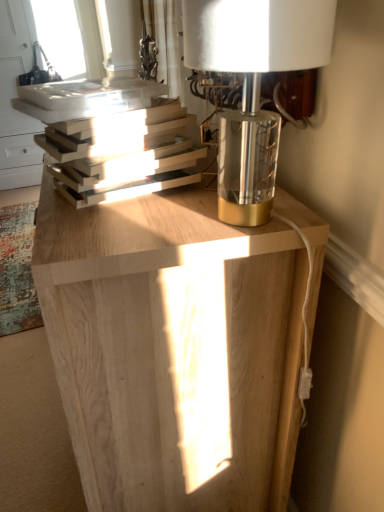
Measure the distance between metallic gold base at upper right and camera.

metallic gold base at upper right and camera are 16.26 inches apart.

This screenshot has height=512, width=384. Identify the location of natural wood table at center. (173, 349).

Describe the element at coordinates (15, 96) in the screenshot. This screenshot has height=512, width=384. I see `clear glass window at upper left` at that location.

At what (x,y) coordinates should I click in order to perform the action: click on hardcover books at left. Please return your answer as a coordinate pair (x, y). This screenshot has height=512, width=384. Looking at the image, I should click on (124, 156).

From the image's perspective, is clear glass window at upper left below metallic gold base at upper right?

No, from the image's perspective, clear glass window at upper left is not beneath metallic gold base at upper right.

Considering the relative sizes of clear glass window at upper left and metallic gold base at upper right in the image provided, is clear glass window at upper left taller than metallic gold base at upper right?

Correct, clear glass window at upper left is much taller as metallic gold base at upper right.

Is clear glass window at upper left wider than metallic gold base at upper right?

Yes.

What's the angular difference between clear glass window at upper left and metallic gold base at upper right's facing directions?

There is a 91.6-degree angle between the facing directions of clear glass window at upper left and metallic gold base at upper right.

Which point is more forward, (96, 22) or (190, 215)?

The point (190, 215) is closer.

Is there a large distance between clear glass window at upper left and natural wood table at center?

That's right, there is a large distance between clear glass window at upper left and natural wood table at center.

Do you think clear glass window at upper left is within natural wood table at center, or outside of it?

clear glass window at upper left is located beyond the bounds of natural wood table at center.

Would you say natural wood table at center is a long distance from clear glass window at upper left?

natural wood table at center is positioned a significant distance from clear glass window at upper left.

Is natural wood table at center oriented away from clear glass window at upper left?

No, clear glass window at upper left is not at the back of natural wood table at center.

Considering the positions of points (94, 350) and (32, 143), is point (94, 350) closer to camera compared to point (32, 143)?

Yes, it is in front of point (32, 143).

From a real-world perspective, which object stands above the other?

clear glass window at upper left is physically above.

Is metallic gold base at upper right completely or partially inside natural wood table at center?

No, metallic gold base at upper right is not inside natural wood table at center.

Which point is more distant from viewer, (298, 293) or (331, 35)?

The point (298, 293) is more distant.

Which is more to the left, natural wood table at center or metallic gold base at upper right?

natural wood table at center.

Considering the sizes of metallic gold base at upper right and natural wood table at center in the image, is metallic gold base at upper right bigger or smaller than natural wood table at center?

In the image, metallic gold base at upper right appears to be smaller than natural wood table at center.

Where is `lamp on the right side of natural wood table at center`? This screenshot has width=384, height=512. lamp on the right side of natural wood table at center is located at coordinates (253, 85).

Does metallic gold base at upper right appear on the right side of natural wood table at center?

Indeed, metallic gold base at upper right is positioned on the right side of natural wood table at center.

Looking at their sizes, would you say metallic gold base at upper right is wider or thinner than natural wood table at center?

metallic gold base at upper right is thinner than natural wood table at center.

Consider the image. Is hardcover books at left oriented away from natural wood table at center?

No, hardcover books at left is not facing the opposite direction of natural wood table at center.

Can you confirm if hardcover books at left is thinner than natural wood table at center?

Yes, hardcover books at left is thinner than natural wood table at center.

What's the angular difference between hardcover books at left and natural wood table at center's facing directions?

The facing directions of hardcover books at left and natural wood table at center are 24.9 degrees apart.

Which of these two, clear glass window at upper left or hardcover books at left, is wider?

Wider between the two is clear glass window at upper left.

Can you confirm if clear glass window at upper left is bigger than hardcover books at left?

Yes, clear glass window at upper left is bigger than hardcover books at left.

Would you say clear glass window at upper left contains hardcover books at left?

No, hardcover books at left is not a part of clear glass window at upper left.

Which object is more forward, clear glass window at upper left or hardcover books at left?

hardcover books at left is more forward.

Identify the location of lamp in front of the clear glass window at upper left. The width and height of the screenshot is (384, 512). (253, 85).

Where is `table that appears below the clear glass window at upper left (from the image's perspective)`? This screenshot has width=384, height=512. table that appears below the clear glass window at upper left (from the image's perspective) is located at coordinates (173, 349).

Considering their positions, is hardcover books at left positioned closer to metallic gold base at upper right than natural wood table at center?

Based on the image, hardcover books at left appears to be nearer to metallic gold base at upper right.

Estimate the real-world distances between objects in this image. Which object is further from metallic gold base at upper right, natural wood table at center or hardcover books at left?

The object further to metallic gold base at upper right is natural wood table at center.

When comparing their distances from natural wood table at center, does clear glass window at upper left or metallic gold base at upper right seem further?

clear glass window at upper left.

When comparing their distances from clear glass window at upper left, does hardcover books at left or natural wood table at center seem closer?

The object closer to clear glass window at upper left is hardcover books at left.

Looking at the image, which one is located further to hardcover books at left, clear glass window at upper left or natural wood table at center?

The object further to hardcover books at left is clear glass window at upper left.

Considering their positions, is metallic gold base at upper right positioned closer to natural wood table at center than clear glass window at upper left?

Among the two, metallic gold base at upper right is located nearer to natural wood table at center.

Considering their positions, is natural wood table at center positioned closer to clear glass window at upper left than hardcover books at left?

hardcover books at left lies closer to clear glass window at upper left than the other object.

Based on their spatial positions, is natural wood table at center or metallic gold base at upper right closer to hardcover books at left?

metallic gold base at upper right lies closer to hardcover books at left than the other object.

Find the location of a particular element. This screenshot has height=512, width=384. lamp between hardcover books at left and natural wood table at center from top to bottom is located at coordinates (253, 85).

Locate an element on the screen. table positioned between metallic gold base at upper right and clear glass window at upper left from near to far is located at coordinates (173, 349).

In order to click on book between natural wood table at center and clear glass window at upper left in the front-back direction in this screenshot , I will do [124, 156].

Locate an element on the screen. Image resolution: width=384 pixels, height=512 pixels. book between metallic gold base at upper right and clear glass window at upper left along the z-axis is located at coordinates (124, 156).